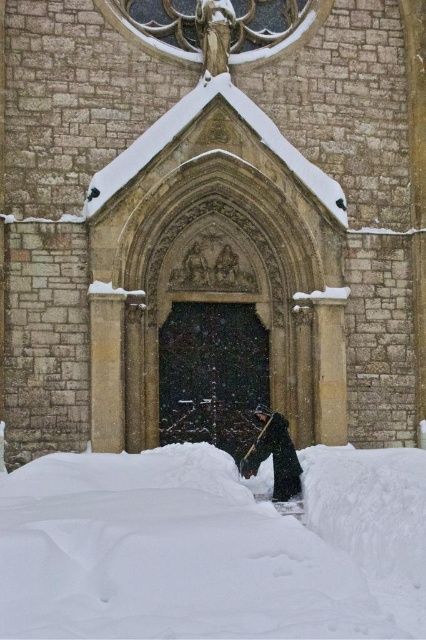
Question: Estimate the real-world distances between objects in this image. Which object is closer to the white fluffy snow at lower center?

Choices:
 (A) stone church at center
 (B) dark woolen coat at center

Answer: (B)

Question: Which of these objects is positioned closest to the dark woolen coat at center?

Choices:
 (A) stone church at center
 (B) white fluffy snow at lower center

Answer: (B)

Question: Where is stone church at center located in relation to white fluffy snow at lower center in the image?

Choices:
 (A) below
 (B) above

Answer: (B)

Question: Which point is closer to the camera?

Choices:
 (A) dark woolen coat at center
 (B) stone church at center

Answer: (A)

Question: Is stone church at center above dark woolen coat at center?

Choices:
 (A) no
 (B) yes

Answer: (B)

Question: Is stone church at center to the right of dark woolen coat at center from the viewer's perspective?

Choices:
 (A) no
 (B) yes

Answer: (A)